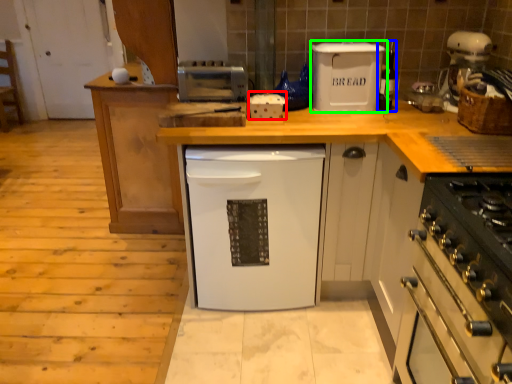
Question: Estimate the real-world distances between objects in this image. Which object is closer to appliance (highlighted by a red box), appliance (highlighted by a blue box) or kitchen appliance (highlighted by a green box)?

Choices:
 (A) appliance
 (B) kitchen appliance

Answer: (B)